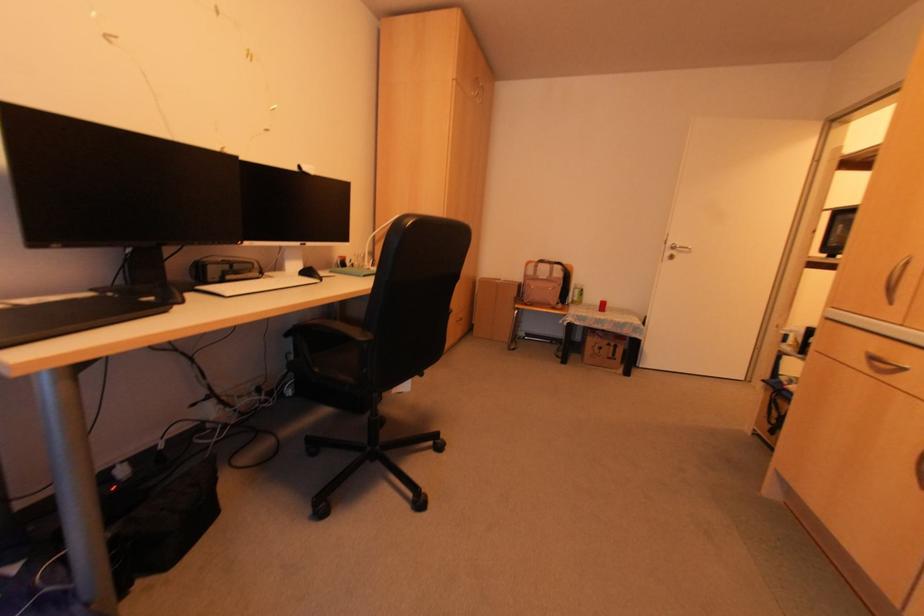
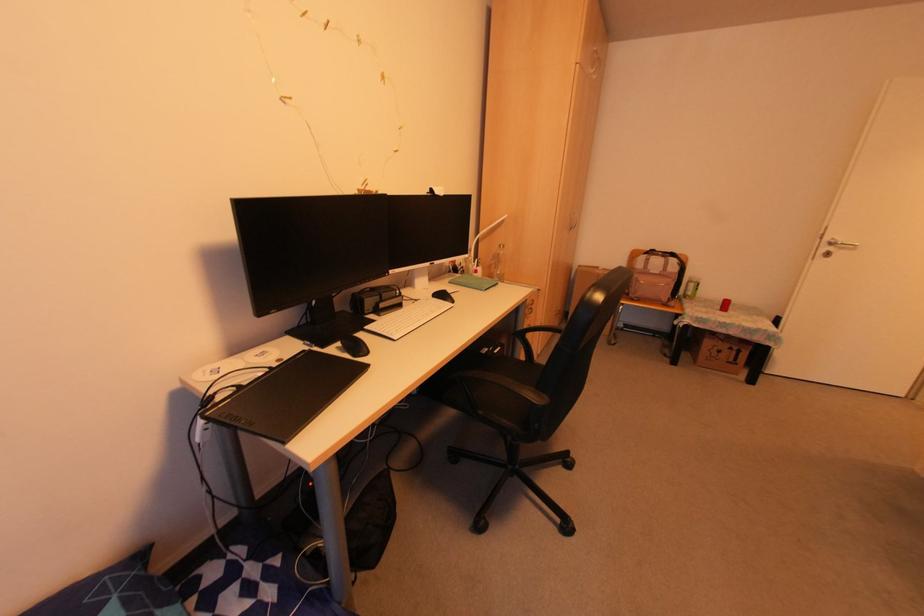
Locate, in the second image, the point that corresponds to pixel 604 342 in the first image.

(725, 346)